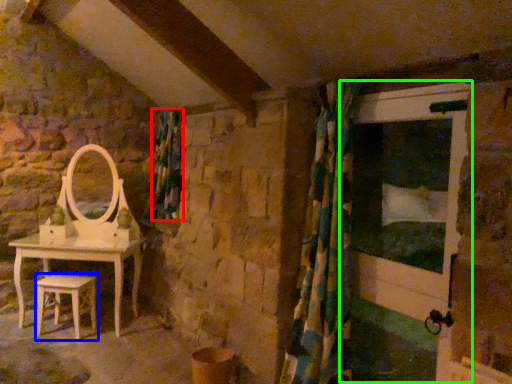
Question: Based on their relative distances, which object is farther from curtain (highlighted by a red box)? Choose from stool (highlighted by a blue box) and screen door (highlighted by a green box).

Choices:
 (A) stool
 (B) screen door

Answer: (B)